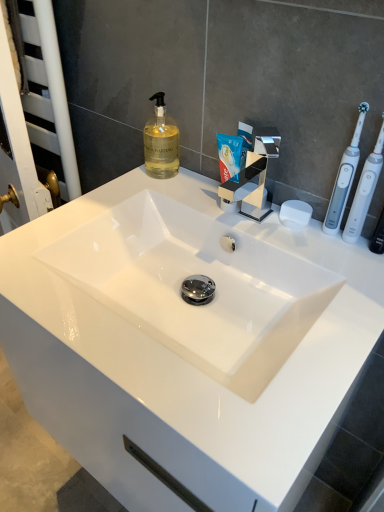
I want to click on vacant area that is in front of white plastic toothbrush at right, positioned as the second toothbrush in left-to-right order, so click(x=349, y=293).